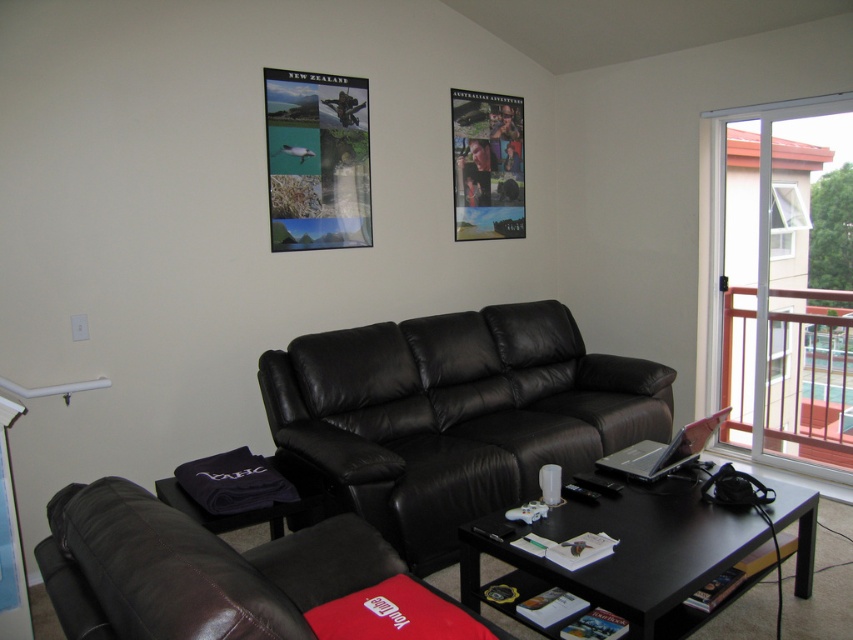
Question: Can you confirm if metallic poster at upper center is positioned to the left of metallic poster at upper right?

Choices:
 (A) no
 (B) yes

Answer: (B)

Question: Among these points, which one is farthest from the camera?

Choices:
 (A) (345, 196)
 (B) (57, 541)
 (C) (457, 376)
 (D) (480, 109)

Answer: (D)

Question: Which of the following is the closest to the observer?

Choices:
 (A) (279, 116)
 (B) (460, 125)
 (C) (170, 525)
 (D) (786, 323)

Answer: (C)

Question: From the image, what is the correct spatial relationship of transparent glass door at right in relation to metallic poster at upper center?

Choices:
 (A) above
 (B) below

Answer: (B)

Question: Can you confirm if transparent glass door at right is bigger than black glossy table at center?

Choices:
 (A) yes
 (B) no

Answer: (A)

Question: Which point is closer to the camera?

Choices:
 (A) transparent glass door at right
 (B) black leather couch at lower left
 (C) black leather couch at center

Answer: (B)